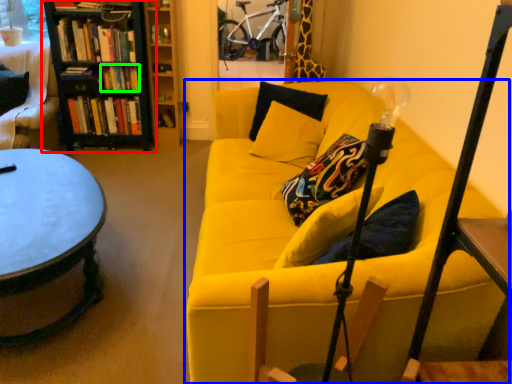
Question: Which object is positioned closest to bookcase (highlighted by a red box)? Select from studio couch (highlighted by a blue box) and book (highlighted by a green box).

Choices:
 (A) studio couch
 (B) book

Answer: (B)